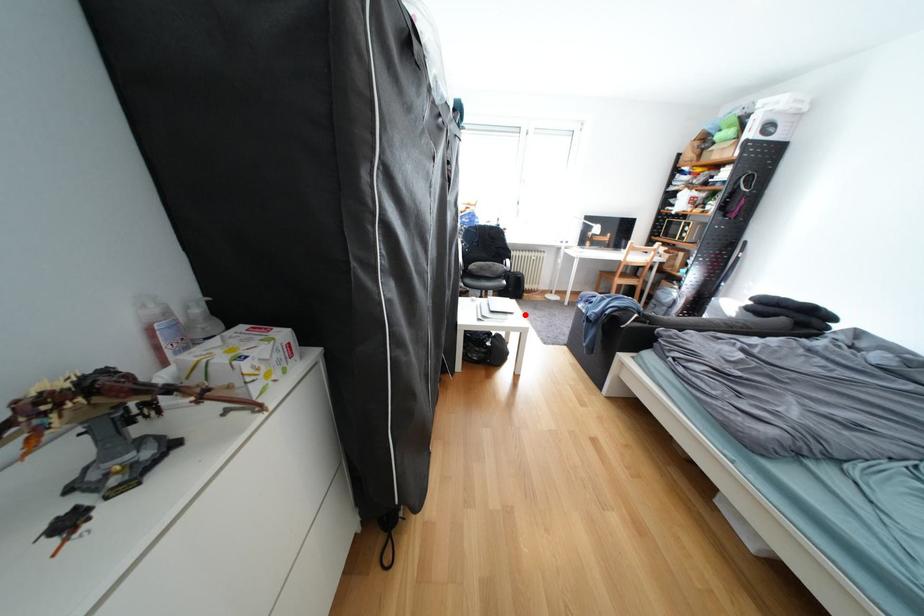
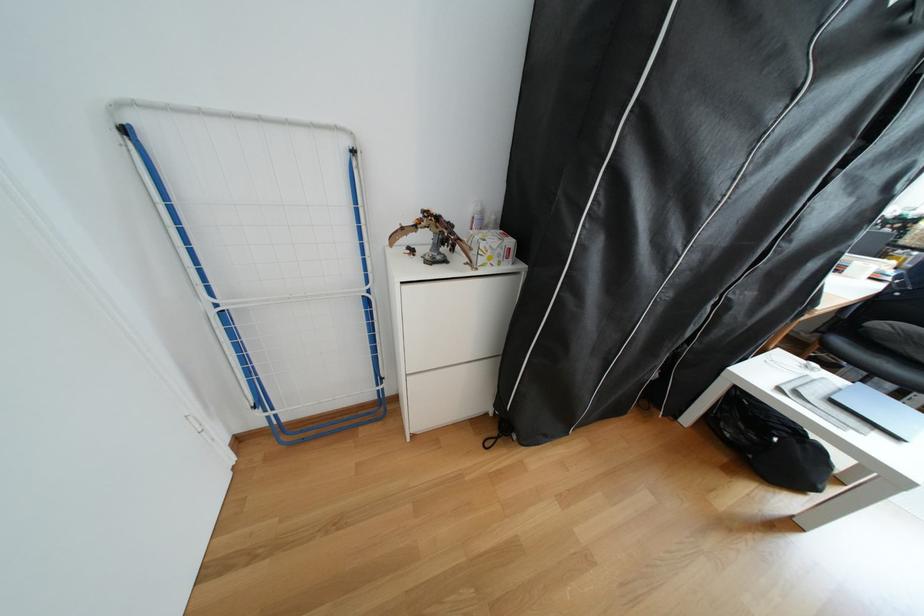
Locate, in the second image, the point that corresponds to the highlighted location in the first image.

(908, 439)